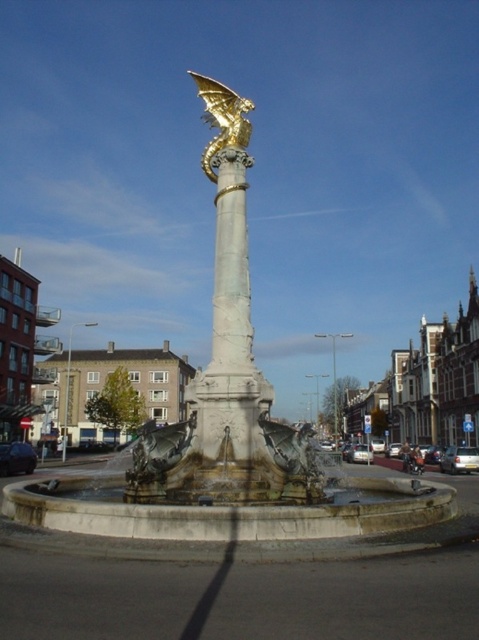
Can you confirm if bronze fountain at center is positioned to the left of gold metallic dragon at upper center?

No, bronze fountain at center is not to the left of gold metallic dragon at upper center.

The image size is (479, 640). What are the coordinates of `bronze fountain at center` in the screenshot? It's located at (228, 445).

Between point (228, 163) and point (236, 134), which one is positioned in front?

Point (228, 163)

The width and height of the screenshot is (479, 640). Find the location of `white marble column at center`. white marble column at center is located at coordinates (x=229, y=330).

I want to click on white marble column at center, so click(229, 330).

Who is more distant from viewer, (193,400) or (219,337)?

Point (219,337)

Between point (424, 522) and point (246, 384), which one is positioned in front?

Point (424, 522)

Who is more distant from viewer, [218,307] or [247,312]?

Point [247,312]

Image resolution: width=479 pixels, height=640 pixels. Identify the location of bronze fountain at center. (228, 445).